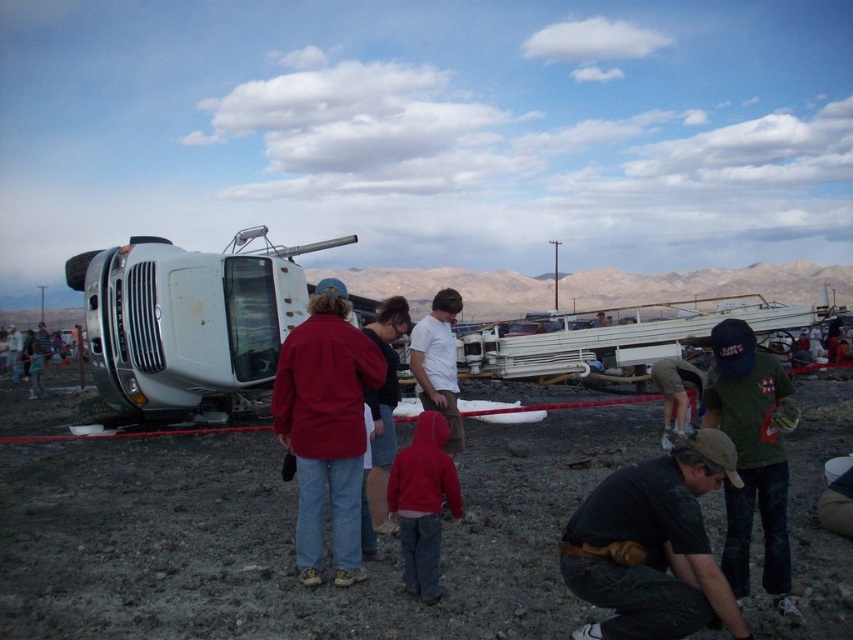
Measure the distance between red fleece jacket at center and matte red jacket at center.

They are 5.21 feet apart.

Is point (402, 556) farther from viewer compared to point (387, 317)?

No, it is in front of (387, 317).

Locate an element on the screen. The height and width of the screenshot is (640, 853). red fleece jacket at center is located at coordinates (422, 502).

Which is above, green cotton shirt at center or red jacket at center?

red jacket at center

Is point (758, 451) positioned before point (61, 349)?

Yes, point (758, 451) is in front of point (61, 349).

Between point (761, 401) and point (13, 349), which one is positioned in front?

Point (761, 401) is in front.

Identify the location of green cotton shirt at center. (751, 458).

Is white matte truck at left bigger than red fleece jacket at center?

Yes, white matte truck at left is bigger than red fleece jacket at center.

Is white matte truck at left above red fleece jacket at center?

Correct, white matte truck at left is located above red fleece jacket at center.

Which is in front, point (224, 339) or point (428, 428)?

Point (428, 428)

You are a GUI agent. You are given a task and a screenshot of the screen. Output one action in this format:
    pyautogui.click(x=<x>, y=<y>)
    Task: Click on the white matte truck at left
    Image resolution: width=853 pixels, height=640 pixels.
    Given the screenshot: What is the action you would take?
    pyautogui.click(x=189, y=321)